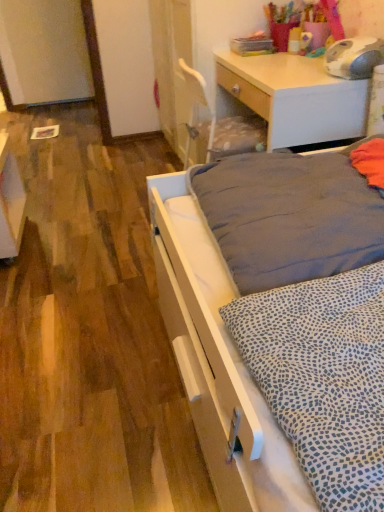
Question: Looking at their shapes, would you say white glossy vanity at lower left is wider or thinner than light wood desk at upper right?

Choices:
 (A) thin
 (B) wide

Answer: (A)

Question: Is point (8, 197) closer or farther from the camera than point (344, 137)?

Choices:
 (A) farther
 (B) closer

Answer: (A)

Question: Estimate the real-world distances between objects in this image. Which object is farther from the dark gray fabric mattress at center?

Choices:
 (A) light wood desk at upper right
 (B) white glossy vanity at lower left
 (C) white matte bed at lower right

Answer: (B)

Question: Which of these objects is positioned closest to the white glossy vanity at lower left?

Choices:
 (A) light wood desk at upper right
 (B) white matte bed at lower right
 (C) dark gray fabric mattress at center

Answer: (B)